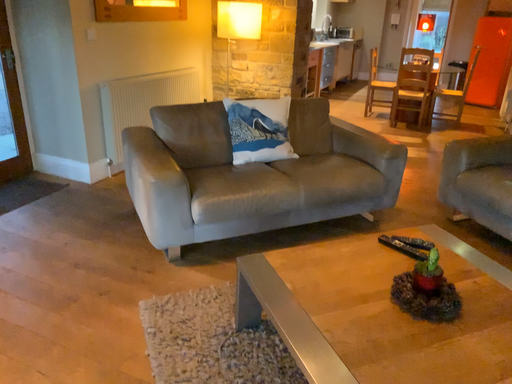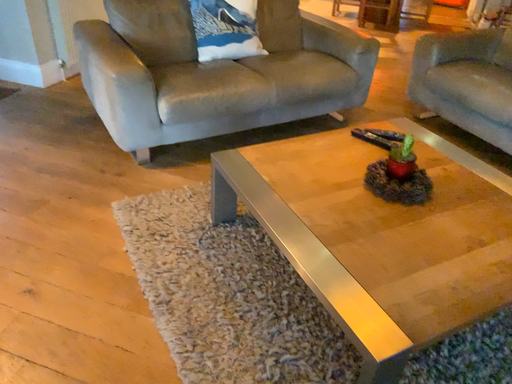
Question: How did the camera likely rotate when shooting the video?

Choices:
 (A) rotated downward
 (B) rotated upward

Answer: (A)